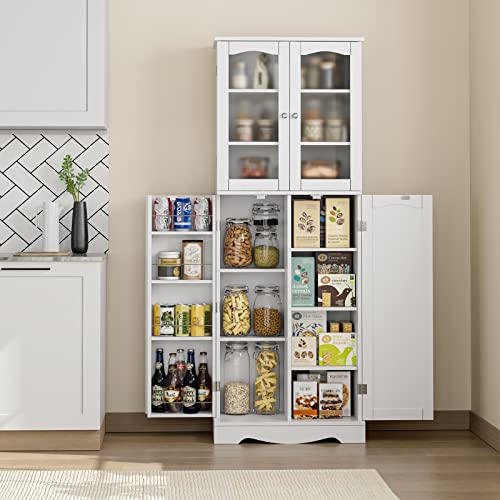
Image resolution: width=500 pixels, height=500 pixels. What are the coordinates of `pantry doors` in the screenshot? It's located at (323, 121), (241, 142), (169, 243), (401, 255).